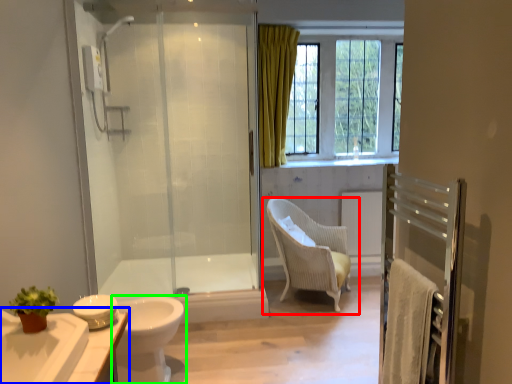
Question: Which object is the farthest from chair (highlighted by a red box)? Choose among these: bathroom cabinet (highlighted by a blue box) or toilet (highlighted by a green box).

Choices:
 (A) bathroom cabinet
 (B) toilet

Answer: (A)